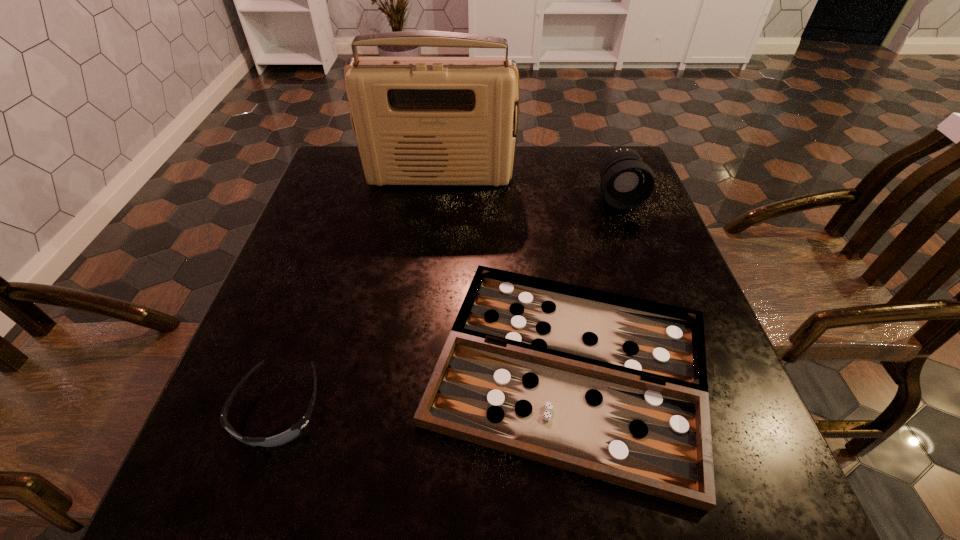
At what (x,y) coordinates should I click in order to perform the action: click on free space between the third tallest object and the radio receiver. Please return your answer as a coordinate pair (x, y). This screenshot has height=540, width=960. Looking at the image, I should click on (359, 293).

The width and height of the screenshot is (960, 540). I want to click on vacant space that's between the sunglasses and the tallest object, so click(359, 293).

This screenshot has width=960, height=540. I want to click on vacant area that lies between the sunglasses and the tallest object, so click(x=359, y=293).

Select which object is the second closest to the sunglasses. Please provide its 2D coordinates. Your answer should be formatted as a tuple, i.e. [(x, y)], where the tuple contains the x and y coordinates of a point satisfying the conditions above.

[(417, 120)]

Locate an element on the screen. Image resolution: width=960 pixels, height=540 pixels. object that ranks as the closest to the telephoto lens is located at coordinates (417, 120).

Where is `free point that satisfies the following two spatial constraints: 1. on the front-facing side of the gameboard; 2. on the left side of the radio receiver`? free point that satisfies the following two spatial constraints: 1. on the front-facing side of the gameboard; 2. on the left side of the radio receiver is located at coordinates click(418, 369).

Identify the location of free point that satisfies the following two spatial constraints: 1. on the front-facing side of the tallest object; 2. on the left side of the gameboard. The width and height of the screenshot is (960, 540). (418, 369).

Identify the location of vacant space that satisfies the following two spatial constraints: 1. on the front-facing side of the radio receiver; 2. on the right side of the shortest object. (418, 369).